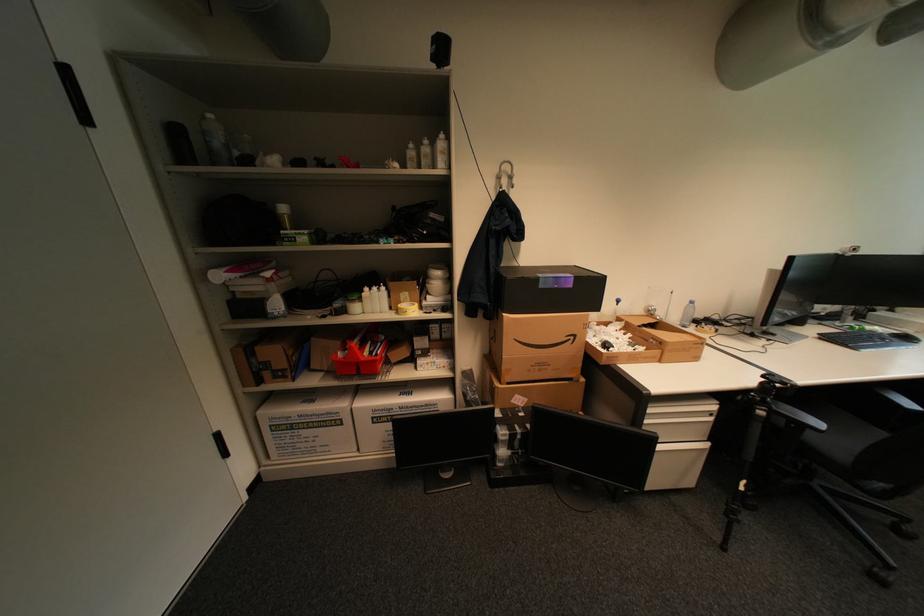
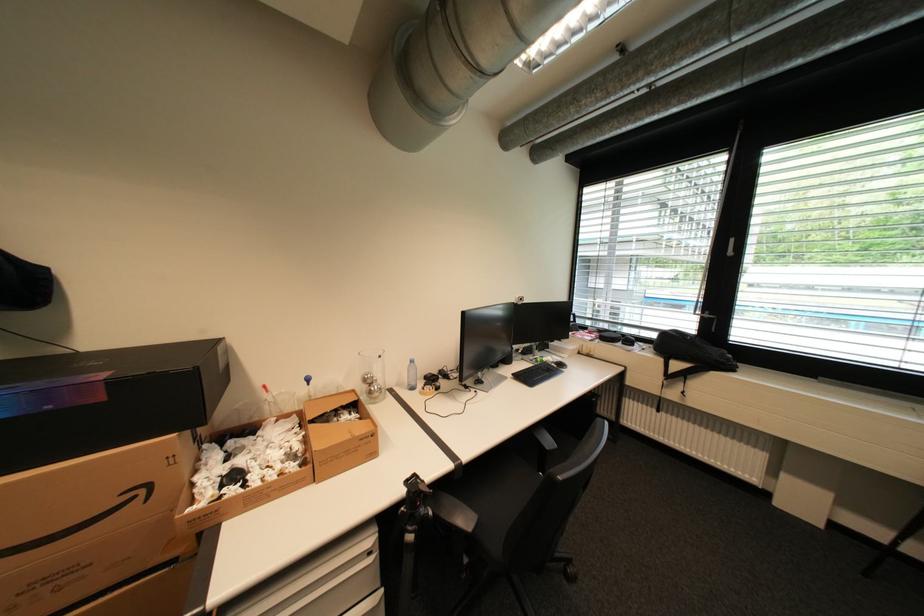
In the second image, find the point that corresponds to point 702,344 in the first image.

(370, 440)